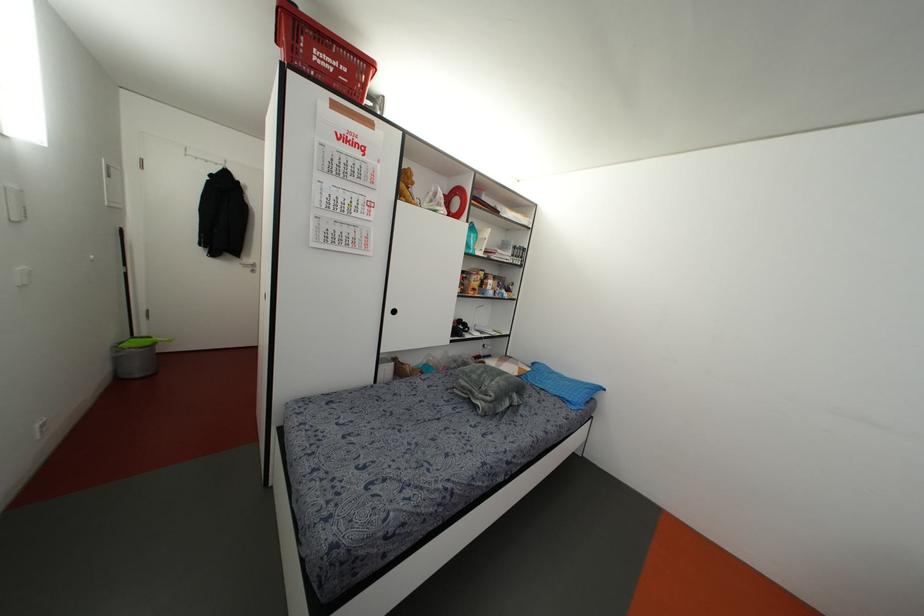
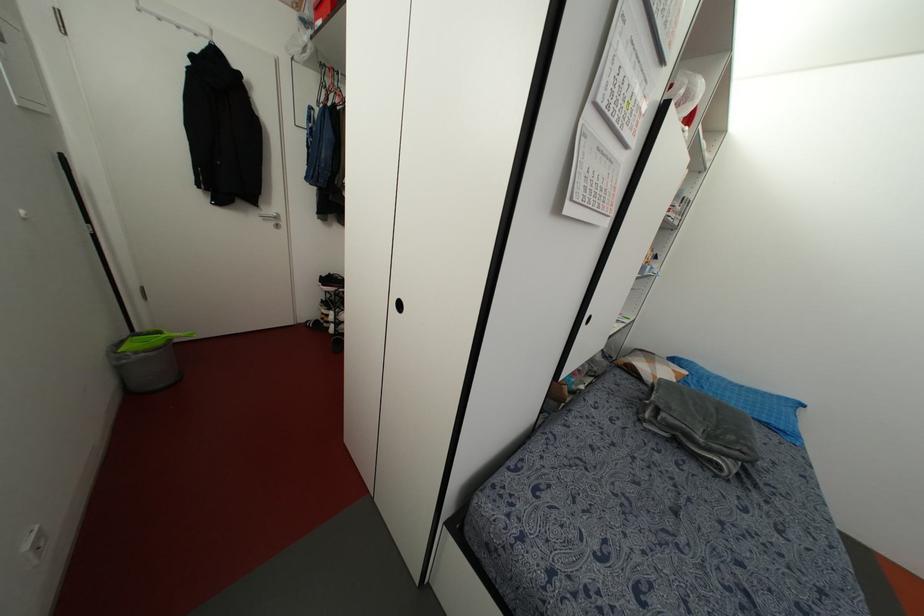
The point at [459,379] is marked in the first image. Where is the corresponding point in the second image?

(663, 415)